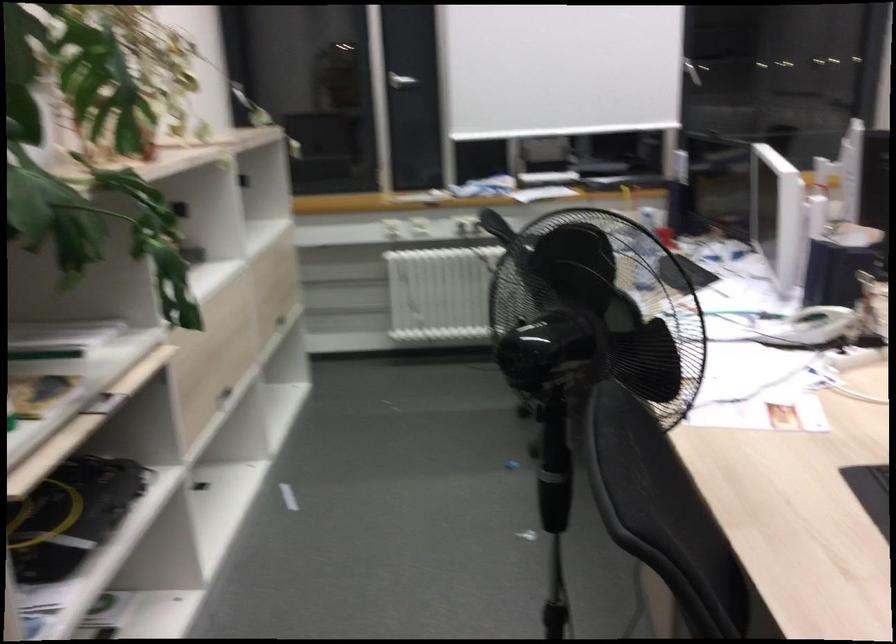
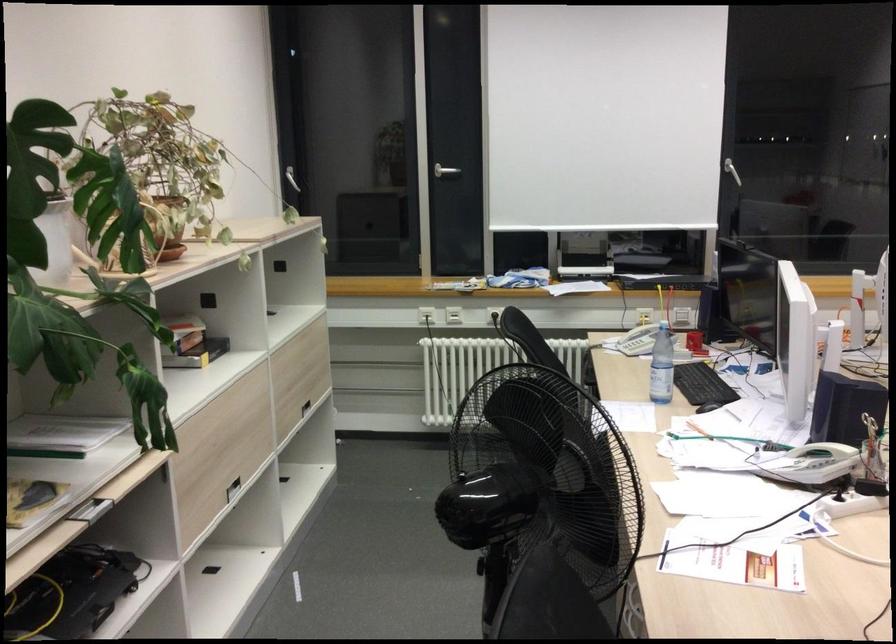
The point at [273,287] is marked in the first image. Where is the corresponding point in the second image?

(298, 375)